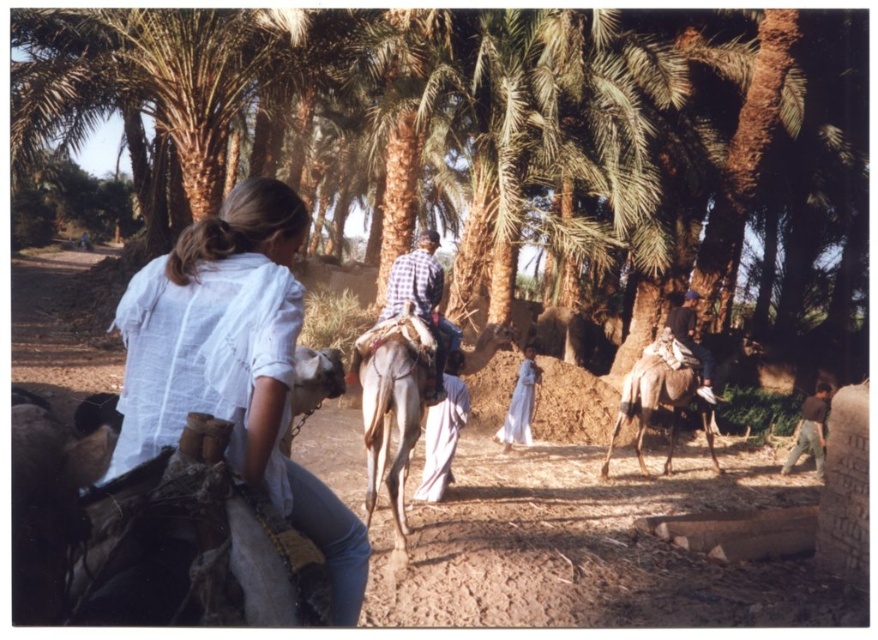
Question: Which object appears farthest from the camera in this image?

Choices:
 (A) white textured camel at center
 (B) dark brown leather saddle at right
 (C) brown cotton shirt at lower right

Answer: (C)

Question: Which is farther from the white textured camel at center?

Choices:
 (A) light brown textured camel at right
 (B) dark brown leather saddle at right
 (C) white cotton shirt at center
 (D) light brown textured camel at center

Answer: (B)

Question: Among these points, which one is farthest from the camera?

Choices:
 (A) (450, 353)
 (B) (711, 397)

Answer: (B)

Question: Is white cotton shirt at center to the left of dark brown leather saddle at right from the viewer's perspective?

Choices:
 (A) yes
 (B) no

Answer: (A)

Question: Does white textured camel at center have a greater width compared to light brown textured camel at center?

Choices:
 (A) no
 (B) yes

Answer: (B)

Question: Is white cotton shirt at center further to camera compared to white textured camel at center?

Choices:
 (A) yes
 (B) no

Answer: (A)